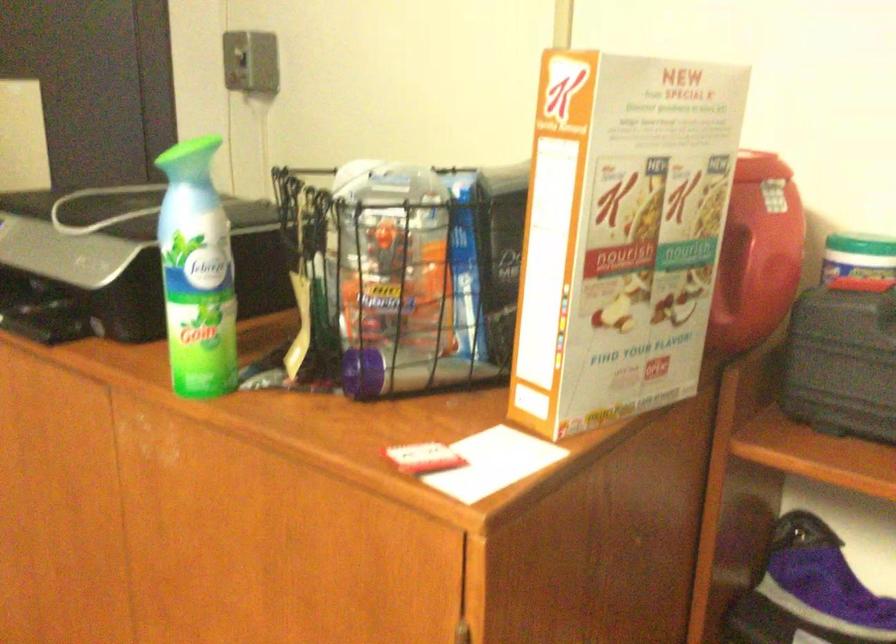
Find where to unscrew the small container lid. Please return your answer as a coordinate pair (x, y).

(862, 249)